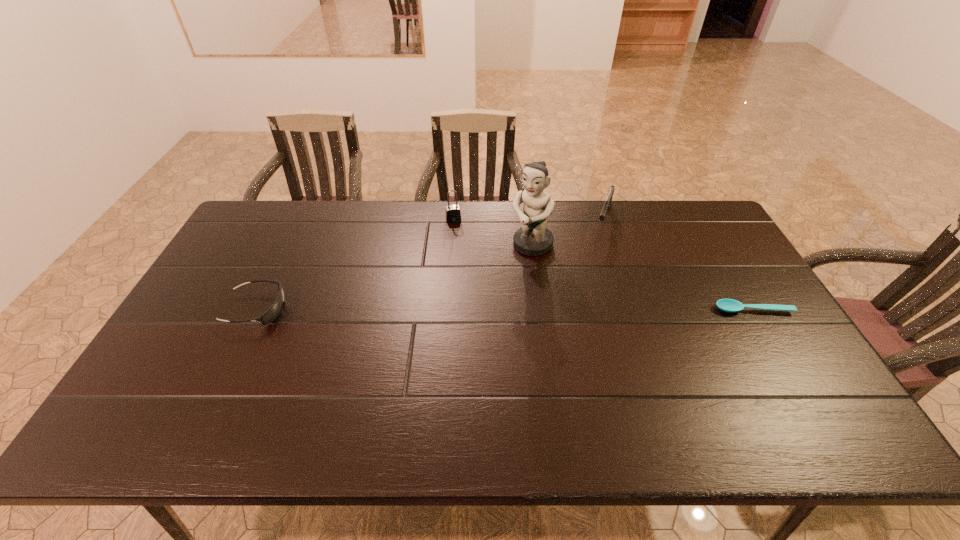
I want to click on the second shortest object, so click(274, 310).

Where is `goggles`? This screenshot has height=540, width=960. goggles is located at coordinates (274, 310).

The height and width of the screenshot is (540, 960). What are the coordinates of `the rightmost object` in the screenshot? It's located at (729, 305).

Identify the location of the shortest object. (729, 305).

You are a GUI agent. You are given a task and a screenshot of the screen. Output one action in this format:
    pyautogui.click(x=<x>, y=<y>)
    Task: Click on the tallest object
    Image resolution: width=960 pixels, height=540 pixels.
    Given the screenshot: What is the action you would take?
    pyautogui.click(x=533, y=238)

The height and width of the screenshot is (540, 960). In order to click on figurine in this screenshot , I will do `click(533, 238)`.

You are a GUI agent. You are given a task and a screenshot of the screen. Output one action in this format:
    pyautogui.click(x=<x>, y=<y>)
    Task: Click on the fourth object from right to left
    Image resolution: width=960 pixels, height=540 pixels.
    Given the screenshot: What is the action you would take?
    pyautogui.click(x=453, y=214)

Locate an element on the screen. padlock is located at coordinates (453, 214).

The width and height of the screenshot is (960, 540). I want to click on gun, so click(607, 203).

This screenshot has height=540, width=960. Identify the location of the third shortest object. (607, 203).